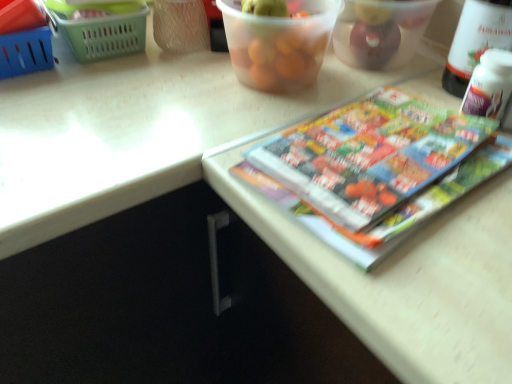
Image resolution: width=512 pixels, height=384 pixels. What do you see at coordinates (381, 32) in the screenshot? I see `translucent plastic container at upper center, which ranks as the second glass bowl in left-to-right order` at bounding box center [381, 32].

Measure the distance between point (376, 209) and camera.

Point (376, 209) is 17.17 inches away from camera.

What do you see at coordinates (25, 52) in the screenshot? I see `blue plastic basket at upper left, the 2th basket from the right` at bounding box center [25, 52].

You are a GUI agent. You are given a task and a screenshot of the screen. Output one action in this format:
    pyautogui.click(x=<x>, y=<y>)
    Task: Click on the transparent plastic container at upper center, which appears as the 2th glass bowl when viewed from the right
    This screenshot has height=384, width=512.
    Given the screenshot: What is the action you would take?
    [279, 44]

Locate an element on the screen. Image resolution: width=512 pixels, height=384 pixels. translucent plastic container at upper center, which appears as the 1th glass bowl when viewed from the right is located at coordinates (381, 32).

From the image's perspective, would you say blue plastic basket at upper left, acting as the first basket starting from the left, is shown under translucent plastic container at upper center, which ranks as the second glass bowl in left-to-right order?

Correct, blue plastic basket at upper left, acting as the first basket starting from the left, appears lower than translucent plastic container at upper center, which ranks as the second glass bowl in left-to-right order, in the image.

Looking at this image, from a real-world perspective, does blue plastic basket at upper left, the 2th basket from the right, stand above translucent plastic container at upper center, which ranks as the second glass bowl in left-to-right order?

No, from a real-world perspective, blue plastic basket at upper left, the 2th basket from the right, is not above translucent plastic container at upper center, which ranks as the second glass bowl in left-to-right order.

Is point (4, 48) closer or farther from the camera than point (389, 57)?

Point (4, 48) is positioned closer to the camera compared to point (389, 57).

Based on the photo, between blue plastic basket at upper left, acting as the first basket starting from the left, and translucent plastic container at upper center, which appears as the 1th glass bowl when viewed from the right, which one has smaller size?

With smaller size is blue plastic basket at upper left, acting as the first basket starting from the left.

Considering the relative positions of transparent plastic container at upper center, which appears as the 2th glass bowl when viewed from the right, and white plastic bottle at upper right in the image provided, is transparent plastic container at upper center, which appears as the 2th glass bowl when viewed from the right, to the left of white plastic bottle at upper right from the viewer's perspective?

Yes.

Does transparent plastic container at upper center, the first glass bowl in the left-to-right sequence, have a greater height compared to white plastic bottle at upper right?

No.

Is point (231, 55) positioned behind point (471, 71)?

Yes, it is behind point (471, 71).

Considering the relative sizes of transparent plastic container at upper center, the first glass bowl in the left-to-right sequence, and white plastic bottle at upper right in the image provided, is transparent plastic container at upper center, the first glass bowl in the left-to-right sequence, wider than white plastic bottle at upper right?

Indeed, transparent plastic container at upper center, the first glass bowl in the left-to-right sequence, has a greater width compared to white plastic bottle at upper right.

Does point (486, 12) come behind point (142, 12)?

No, it is in front of (142, 12).

Is green plastic basket at upper left, which appears as the 2th basket when viewed from the left, completely or partially inside white plastic bottle at upper right?

No, green plastic basket at upper left, which appears as the 2th basket when viewed from the left, is not inside white plastic bottle at upper right.

Based on the photo, is white plastic bottle at upper right to the left or to the right of green plastic basket at upper left, which appears as the 1th basket when viewed from the right, in the image?

white plastic bottle at upper right is to the right of green plastic basket at upper left, which appears as the 1th basket when viewed from the right.

Is white plastic bottle at upper right shorter than multicolored glossy book at upper right?

Incorrect, the height of white plastic bottle at upper right does not fall short of that of multicolored glossy book at upper right.

Is white plastic bottle at upper right turned away from multicolored glossy book at upper right?

No, white plastic bottle at upper right is not facing away from multicolored glossy book at upper right.

Is white plastic bottle at upper right smaller than multicolored glossy book at upper right?

No.

Does point (467, 7) appear closer or farther from the camera than point (272, 147)?

Point (467, 7) is farther from the camera than point (272, 147).

Is green plastic basket at upper left, which appears as the 1th basket when viewed from the right, thinner than translucent plastic container at upper center, which appears as the 1th glass bowl when viewed from the right?

No.

Consider the image. Is green plastic basket at upper left, which appears as the 2th basket when viewed from the left, outside of translucent plastic container at upper center, which ranks as the second glass bowl in left-to-right order?

Absolutely, green plastic basket at upper left, which appears as the 2th basket when viewed from the left, is external to translucent plastic container at upper center, which ranks as the second glass bowl in left-to-right order.

Could you tell me if green plastic basket at upper left, which appears as the 2th basket when viewed from the left, is facing translucent plastic container at upper center, which appears as the 1th glass bowl when viewed from the right?

No, green plastic basket at upper left, which appears as the 2th basket when viewed from the left, is not aimed at translucent plastic container at upper center, which appears as the 1th glass bowl when viewed from the right.

Consider the image. Which is more to the left, translucent plastic container at upper center, which appears as the 1th glass bowl when viewed from the right, or blue plastic basket at upper left, the 2th basket from the right?

blue plastic basket at upper left, the 2th basket from the right, is more to the left.

Would you say translucent plastic container at upper center, which appears as the 1th glass bowl when viewed from the right, is outside blue plastic basket at upper left, the 2th basket from the right?

Absolutely, translucent plastic container at upper center, which appears as the 1th glass bowl when viewed from the right, is external to blue plastic basket at upper left, the 2th basket from the right.

From the picture: From a real-world perspective, which object rests below the other?

blue plastic basket at upper left, the 2th basket from the right, is physically lower.

The width and height of the screenshot is (512, 384). What are the coordinates of `wine bottle above the transparent plastic container at upper center, which appears as the 2th glass bowl when viewed from the right (from a real-world perspective)` in the screenshot? It's located at (476, 40).

Can we say white plastic bottle at upper right lies outside transparent plastic container at upper center, the first glass bowl in the left-to-right sequence?

Indeed, white plastic bottle at upper right is completely outside transparent plastic container at upper center, the first glass bowl in the left-to-right sequence.

From the image's perspective, is white plastic bottle at upper right positioned above or below transparent plastic container at upper center, which appears as the 2th glass bowl when viewed from the right?

white plastic bottle at upper right is situated lower than transparent plastic container at upper center, which appears as the 2th glass bowl when viewed from the right, in the image.

Can you confirm if white plastic bottle at upper right is thinner than transparent plastic container at upper center, the first glass bowl in the left-to-right sequence?

Correct, the width of white plastic bottle at upper right is less than that of transparent plastic container at upper center, the first glass bowl in the left-to-right sequence.

From the image's perspective, count 2nd baskets downward from the translucent plastic container at upper center, which appears as the 1th glass bowl when viewed from the right, and point to it. Please provide its 2D coordinates.

[(25, 52)]

Find the location of `the 1st glass bowl located beneath the white plastic bottle at upper right (from a real-world perspective)`. the 1st glass bowl located beneath the white plastic bottle at upper right (from a real-world perspective) is located at coordinates (279, 44).

Looking at the image, which one is located further to transparent plastic container at upper center, which appears as the 2th glass bowl when viewed from the right, blue plastic basket at upper left, the 2th basket from the right, or multicolored glossy book at upper right?

blue plastic basket at upper left, the 2th basket from the right, is positioned further to the anchor transparent plastic container at upper center, which appears as the 2th glass bowl when viewed from the right.

Estimate the real-world distances between objects in this image. Which object is closer to translucent plastic container at upper center, which ranks as the second glass bowl in left-to-right order, multicolored glossy book at upper right or transparent plastic container at upper center, which appears as the 2th glass bowl when viewed from the right?

transparent plastic container at upper center, which appears as the 2th glass bowl when viewed from the right.

Which object lies further to the anchor point white plastic bottle at upper right, multicolored glossy book at upper right or translucent plastic container at upper center, which ranks as the second glass bowl in left-to-right order?

multicolored glossy book at upper right.

Looking at this image, from the image, which object appears to be nearer to blue plastic basket at upper left, the 2th basket from the right, transparent plastic container at upper center, the first glass bowl in the left-to-right sequence, or green plastic basket at upper left, which appears as the 2th basket when viewed from the left?

Among the two, green plastic basket at upper left, which appears as the 2th basket when viewed from the left, is located nearer to blue plastic basket at upper left, the 2th basket from the right.

From the image, which object appears to be nearer to transparent plastic container at upper center, the first glass bowl in the left-to-right sequence, multicolored glossy book at upper right or blue plastic basket at upper left, acting as the first basket starting from the left?

The object closer to transparent plastic container at upper center, the first glass bowl in the left-to-right sequence, is multicolored glossy book at upper right.

When comparing their distances from white plastic bottle at upper right, does transparent plastic container at upper center, the first glass bowl in the left-to-right sequence, or blue plastic basket at upper left, the 2th basket from the right, seem closer?

The object closer to white plastic bottle at upper right is transparent plastic container at upper center, the first glass bowl in the left-to-right sequence.

Consider the image. When comparing their distances from multicolored glossy book at upper right, does blue plastic basket at upper left, acting as the first basket starting from the left, or green plastic basket at upper left, which appears as the 1th basket when viewed from the right, seem further?

blue plastic basket at upper left, acting as the first basket starting from the left, is further to multicolored glossy book at upper right.

When comparing their distances from blue plastic basket at upper left, acting as the first basket starting from the left, does transparent plastic container at upper center, which appears as the 2th glass bowl when viewed from the right, or white plastic bottle at upper right seem further?

white plastic bottle at upper right.

Where is `basket located between blue plastic basket at upper left, acting as the first basket starting from the left, and translucent plastic container at upper center, which appears as the 1th glass bowl when viewed from the right, in the left-right direction`? This screenshot has height=384, width=512. basket located between blue plastic basket at upper left, acting as the first basket starting from the left, and translucent plastic container at upper center, which appears as the 1th glass bowl when viewed from the right, in the left-right direction is located at coordinates (100, 28).

This screenshot has height=384, width=512. What are the coordinates of `glass bowl situated between blue plastic basket at upper left, the 2th basket from the right, and translucent plastic container at upper center, which ranks as the second glass bowl in left-to-right order, from left to right` in the screenshot? It's located at (279, 44).

At what (x,y) coordinates should I click in order to perform the action: click on book between green plastic basket at upper left, which appears as the 2th basket when viewed from the left, and translucent plastic container at upper center, which appears as the 1th glass bowl when viewed from the right, from left to right. Please return your answer as a coordinate pair (x, y). The height and width of the screenshot is (384, 512). Looking at the image, I should click on (372, 170).

Locate an element on the screen. This screenshot has height=384, width=512. book situated between green plastic basket at upper left, which appears as the 2th basket when viewed from the left, and white plastic bottle at upper right from left to right is located at coordinates (372, 170).